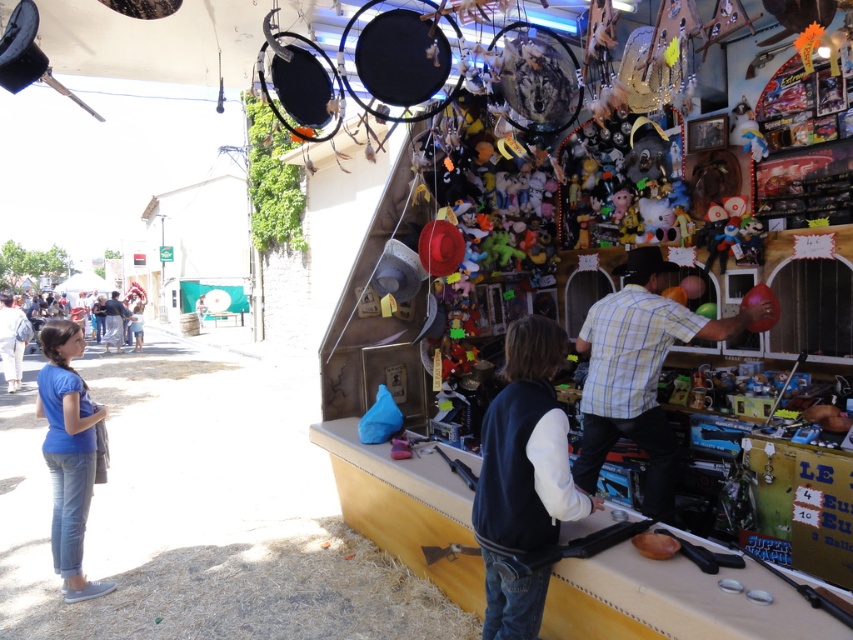
Question: Can you confirm if blue cotton shirt at left is positioned to the left of light blue denim jeans at left?

Choices:
 (A) no
 (B) yes

Answer: (A)

Question: Estimate the real-world distances between objects in this image. Which object is farther from the light blue denim jeans at left?

Choices:
 (A) yellow plaid shirt at center
 (B) blue cotton shirt at left

Answer: (A)

Question: Which object is closer to the camera taking this photo?

Choices:
 (A) yellow plaid shirt at center
 (B) light blue denim jeans at left
 (C) blue cotton shirt at left

Answer: (A)

Question: Does yellow plaid shirt at center have a smaller size compared to light blue denim jeans at left?

Choices:
 (A) yes
 (B) no

Answer: (A)

Question: Estimate the real-world distances between objects in this image. Which object is farther from the blue cotton shirt at left?

Choices:
 (A) light blue denim jeans at left
 (B) yellow plaid shirt at center

Answer: (A)

Question: Where is yellow plaid shirt at center located in relation to blue cotton shirt at left in the image?

Choices:
 (A) below
 (B) above

Answer: (B)